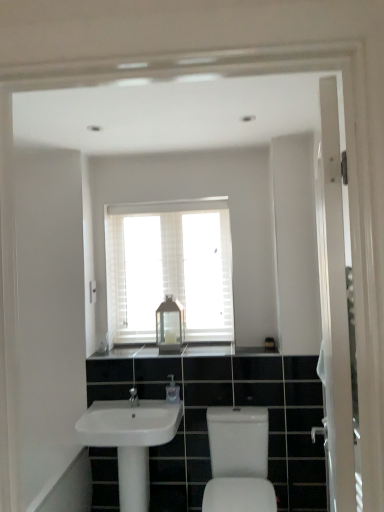
Question: From a real-world perspective, is clear plastic soap dispenser at center over white glossy sink at lower left, which is counted as the 2th sink, starting from the right?

Choices:
 (A) yes
 (B) no

Answer: (A)

Question: Is clear plastic soap dispenser at center facing towards white glossy sink at lower left, which is counted as the 2th sink, starting from the right?

Choices:
 (A) no
 (B) yes

Answer: (A)

Question: Is clear plastic soap dispenser at center at the right side of white glossy sink at lower left, which is counted as the 2th sink, starting from the right?

Choices:
 (A) yes
 (B) no

Answer: (A)

Question: From the image's perspective, is clear plastic soap dispenser at center on top of white glossy sink at lower left, acting as the 1th sink starting from the left?

Choices:
 (A) no
 (B) yes

Answer: (B)

Question: From a real-world perspective, does clear plastic soap dispenser at center sit lower than white glossy sink at lower left, acting as the 1th sink starting from the left?

Choices:
 (A) no
 (B) yes

Answer: (A)

Question: From a real-world perspective, is matte silver tap at center physically located above or below black granite countertop at center?

Choices:
 (A) below
 (B) above

Answer: (A)

Question: Considering the positions of matte silver tap at center and black granite countertop at center in the image, is matte silver tap at center taller or shorter than black granite countertop at center?

Choices:
 (A) short
 (B) tall

Answer: (B)

Question: Does point (130, 400) appear closer or farther from the camera than point (147, 353)?

Choices:
 (A) closer
 (B) farther

Answer: (A)

Question: Visually, is matte silver tap at center positioned to the left or to the right of black granite countertop at center?

Choices:
 (A) right
 (B) left

Answer: (B)

Question: Is white glossy screen door at right in front of or behind white wooden window at center in the image?

Choices:
 (A) front
 (B) behind

Answer: (A)

Question: From a real-world perspective, relative to white wooden window at center, is white glossy screen door at right vertically above or below?

Choices:
 (A) below
 (B) above

Answer: (A)

Question: Based on their sizes in the image, would you say white glossy screen door at right is bigger or smaller than white wooden window at center?

Choices:
 (A) small
 (B) big

Answer: (B)

Question: From the image's perspective, is white glossy screen door at right located above or below white wooden window at center?

Choices:
 (A) below
 (B) above

Answer: (A)

Question: Based on their positions, is matte silver tap at center located to the left or right of white glossy sink at lower left, which is counted as the 2th sink, starting from the right?

Choices:
 (A) right
 (B) left

Answer: (A)

Question: From the image's perspective, relative to white glossy sink at lower left, which is counted as the 2th sink, starting from the right, is matte silver tap at center above or below?

Choices:
 (A) below
 (B) above

Answer: (B)